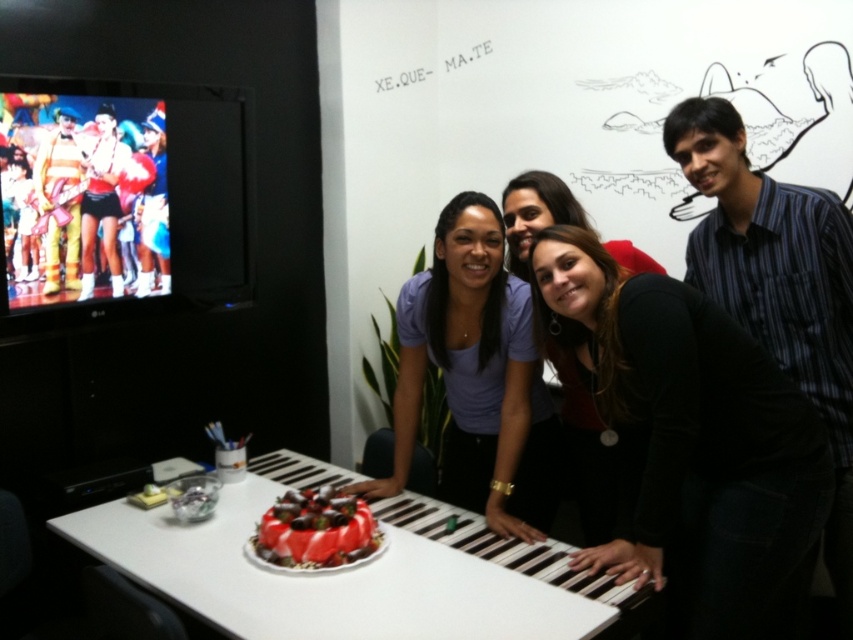
You are a photographer standing at the camera position. You want to adjust your position so that the purple matte shirt at center is exactly 6 feet away from the camera. Is your current position already correct?

The purple matte shirt at center and camera are 6.08 feet apart, so the current position is slightly further than 6 feet. You need to move closer by approximately 0.08 feet to achieve the desired distance.

You are a photographer standing at the camera position. You want to take a closeup shot of the striped cotton shirt at right without moving the camera. Is it possible to zoom in enough to capture the entire shirt in focus?

The striped cotton shirt at right is 1.70 meters from the camera. Since the camera can typically focus on objects within a few meters, it should be possible to zoom in and capture the entire shirt in focus as long as the camera settings allow for sufficient depth of field.